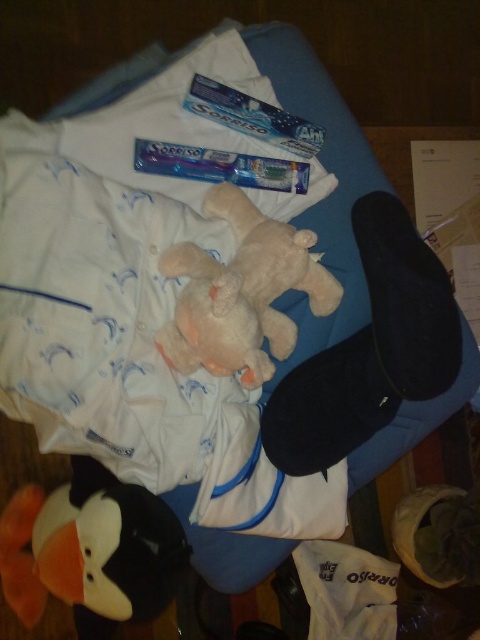
You are a delivery person who just arrived at a customer home. You see the fluffy plush penguin at lower left on a blue cushioned surface. The customer says they want to place the penguin on a shelf that is 36 inches away from where they are standing. Can the penguin reach the shelf if you move it directly forward from its current position?

The fluffy plush penguin at lower left is currently 30.75 inches away from the viewer. Since the shelf is 36 inches away, moving the penguin forward from its current position would require an additional 5.25 inches to reach the shelf. Therefore, the penguin cannot reach the shelf without moving further.

You are organizing a gift basket and need to place the fluffy pink stuffed animal at center and the blue glossy toothpaste at center into a box. Which item should you place first to ensure proper stacking?

The fluffy pink stuffed animal at center should be placed first since it is in front of the blue glossy toothpaste at center, allowing the toothpaste to be stacked on top without shifting the stuffed animal.

You are trying to locate the fluffy plush penguin at lower left on the blue cushioned surface. According to the coordinates provided, where exactly is it positioned?

The fluffy plush penguin at lower left is positioned at coordinates point (91, 550).